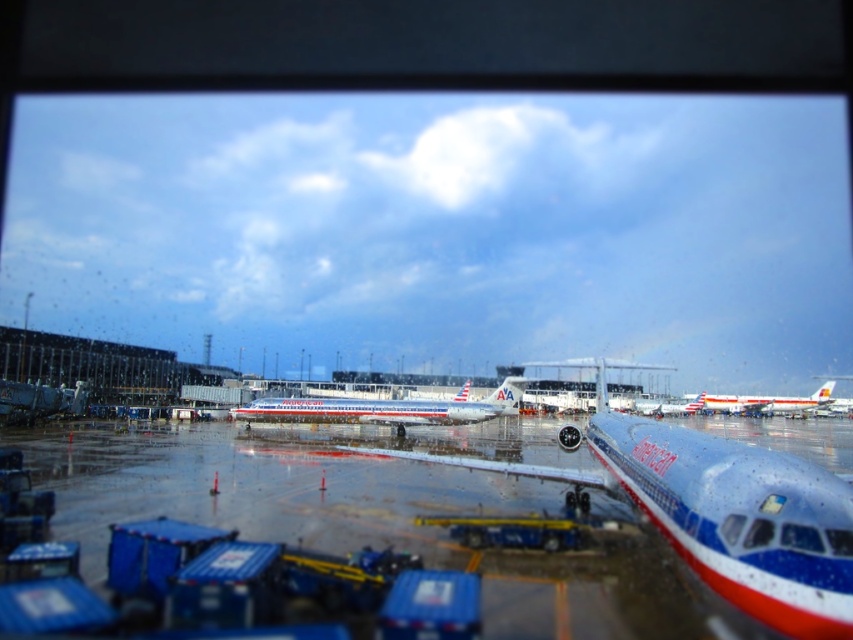
Based on the photo, you are an airport maintenance worker who needs to determine which airplane to service first. You see the silver metallic airplane at center and the white glossy airplane at center. Which one is larger?

The silver metallic airplane at center is bigger than the white glossy airplane at center, so you should service the silver metallic airplane at center first as it may require more resources or time.

You are a pilot looking through the window at the airport tarmac. You see a silver metallic airplane at center and a white glossy airplane at center. Which airplane is closer to you through the window?

The silver metallic airplane at center is closer to you because it is in front of the white glossy airplane at center.